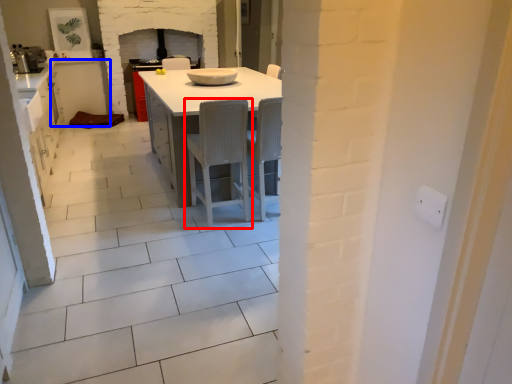
Question: Which point is further to the camera, chair (highlighted by a red box) or cabinetry (highlighted by a blue box)?

Choices:
 (A) chair
 (B) cabinetry

Answer: (B)